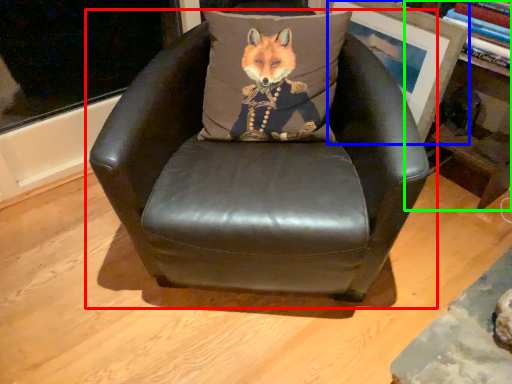
Question: Estimate the real-world distances between objects in this image. Which object is closer to chair (highlighted by a red box), picture frame (highlighted by a blue box) or bookshelf (highlighted by a green box)?

Choices:
 (A) picture frame
 (B) bookshelf

Answer: (A)